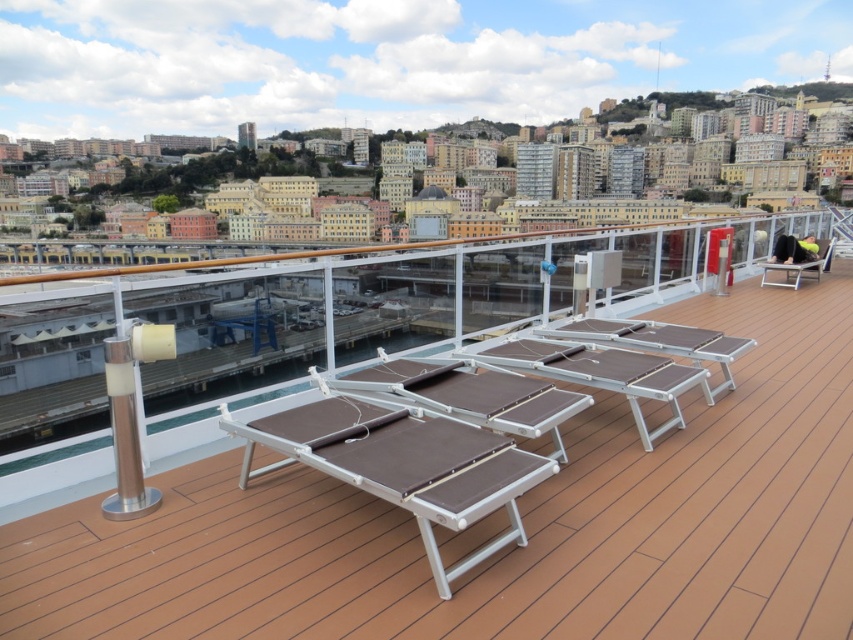
Question: Is brown wood deck at center bigger than brown fabric chair at right?

Choices:
 (A) yes
 (B) no

Answer: (A)

Question: Which point is closer to the camera?

Choices:
 (A) (32, 588)
 (B) (828, 241)

Answer: (A)

Question: Which object is farther from the camera taking this photo?

Choices:
 (A) brown fabric chair at right
 (B) brown wood deck at center

Answer: (A)

Question: Considering the relative positions of brown wood deck at center and brown fabric chair at right in the image provided, where is brown wood deck at center located with respect to brown fabric chair at right?

Choices:
 (A) above
 (B) below

Answer: (B)

Question: Can you confirm if brown wood deck at center is positioned to the right of brown fabric chair at right?

Choices:
 (A) yes
 (B) no

Answer: (B)